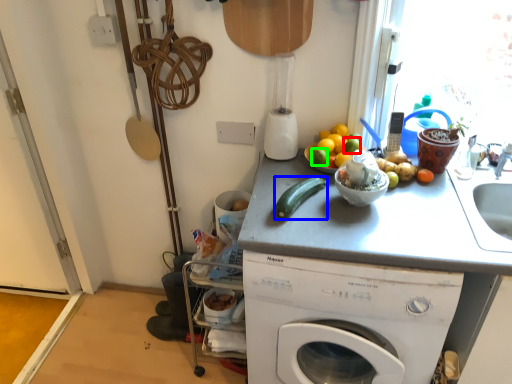
Question: Which is nearer to the lime (highlighted by a red box)? green vegetables (highlighted by a blue box) or lime (highlighted by a green box).

Choices:
 (A) green vegetables
 (B) lime

Answer: (B)